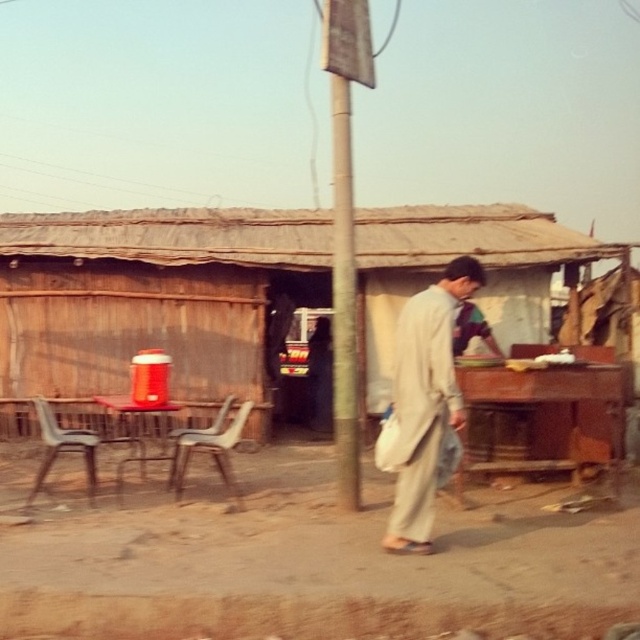
Question: Considering the real-world distances, which object is closest to the plastic/grey chair at left?

Choices:
 (A) light beige fabric robe at center
 (B) metallic pole at center

Answer: (A)

Question: Among these points, which one is nearest to the camera?

Choices:
 (A) (337, 230)
 (B) (108, 442)

Answer: (A)

Question: Which object is closer to the camera taking this photo?

Choices:
 (A) light beige fabric robe at center
 (B) plastic chair at center
 (C) plastic/grey chair at left

Answer: (A)

Question: Does light beige fabric robe at center have a lesser width compared to plastic/grey chair at left?

Choices:
 (A) no
 (B) yes

Answer: (B)

Question: Observing the image, what is the correct spatial positioning of light beige fabric robe at center in reference to metallic pole at center?

Choices:
 (A) above
 (B) below

Answer: (B)

Question: Where is wooden hut at center located in relation to plastic chair at center in the image?

Choices:
 (A) above
 (B) below

Answer: (A)